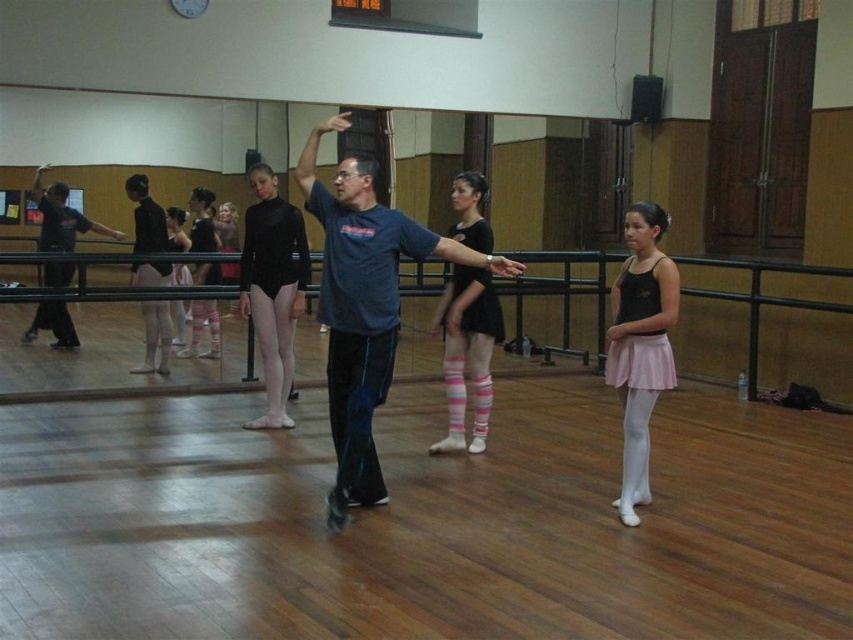
In the dance studio scene, there is a male instructor in a blue t shirt and dark pants standing at the center, and a black leotard at center. Which object is located at the specified coordinate point (273,289)?

The black leotard at center is located at the coordinate point (273,289).

You are a dancer in the studio and need to move from your current position to the instructor. The instructor is at point (76, 216). There is another dancer at point (289, 372). Which point should you avoid to ensure you don not collide with the other dancer?

You should avoid point (289, 372) because it is in front of point (76, 216) where the instructor is located, so moving towards the instructor might lead to a collision with the dancer at point (289, 372).